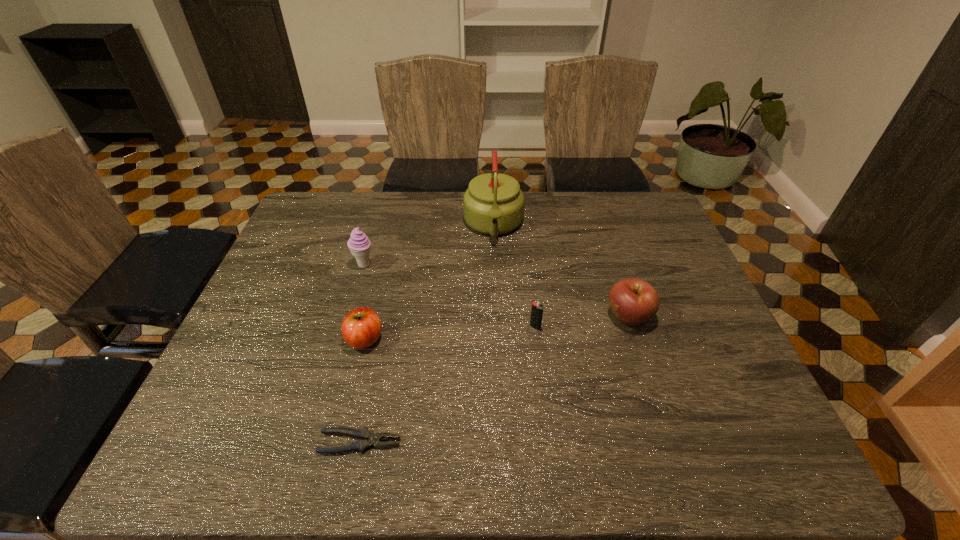
I want to click on vacant space at the far edge, so click(x=573, y=198).

This screenshot has height=540, width=960. I want to click on free space at the left edge, so click(x=286, y=332).

In the image, there is a desktop. Where is `free space at the right edge`? This screenshot has width=960, height=540. free space at the right edge is located at coordinates (676, 301).

Locate an element on the screen. The height and width of the screenshot is (540, 960). vacant space at the far left corner is located at coordinates (315, 204).

Locate an element on the screen. The image size is (960, 540). free space at the far right corner of the desktop is located at coordinates (654, 220).

Image resolution: width=960 pixels, height=540 pixels. What are the coordinates of `vacant space in between the rightmost object and the left apple` in the screenshot? It's located at (496, 328).

This screenshot has height=540, width=960. What are the coordinates of `free space between the shortest object and the igniter` in the screenshot? It's located at (447, 385).

Where is `unoccupied area between the tallest object and the icecream`? unoccupied area between the tallest object and the icecream is located at coordinates (429, 245).

Where is `vacant point located between the right apple and the pliers`? The height and width of the screenshot is (540, 960). vacant point located between the right apple and the pliers is located at coordinates (494, 380).

Where is `unoccupied position between the icecream and the igniter`? unoccupied position between the icecream and the igniter is located at coordinates (x=449, y=296).